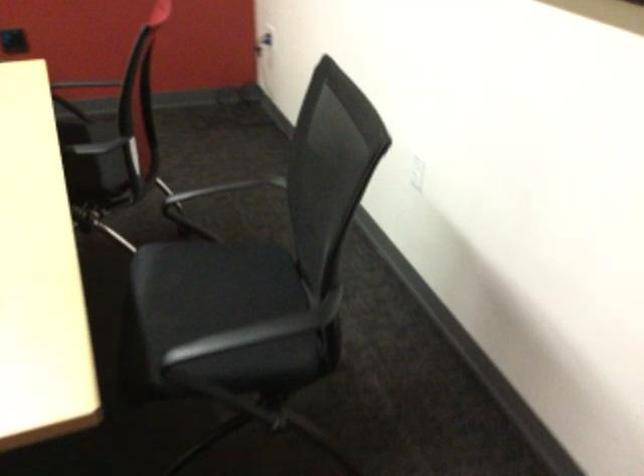
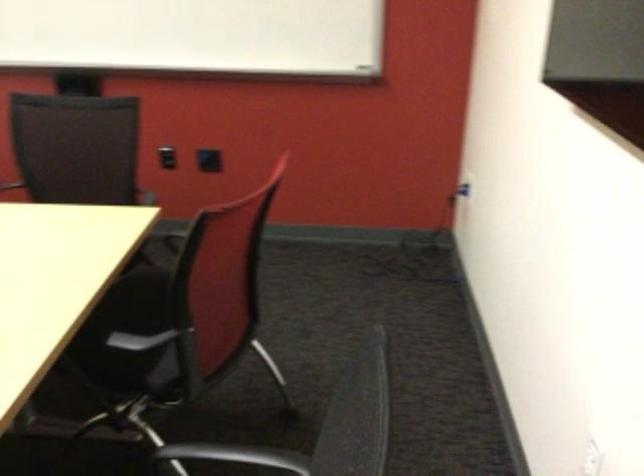
Question: Based on the continuous images, in which direction is the camera rotating? Reply with the corresponding letter.

Choices:
 (A) Left
 (B) Right
 (C) Up
 (D) Down

Answer: (A)